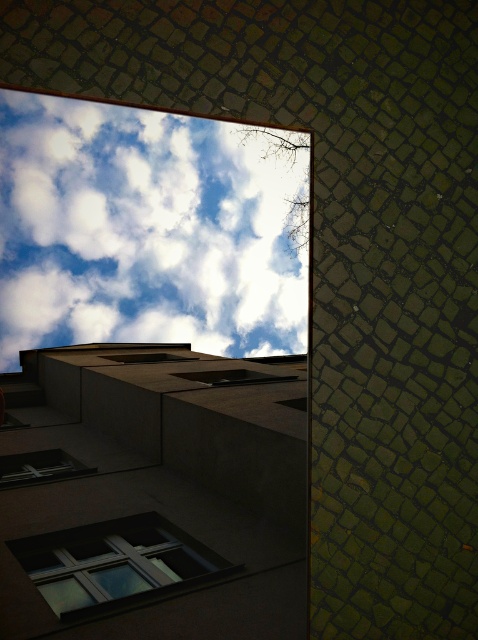
Question: Which point appears closest to the camera in this image?

Choices:
 (A) (181, 321)
 (B) (65, 609)
 (C) (39, 451)

Answer: (C)

Question: Does white fluffy cloud at upper center have a smaller size compared to matte glass window at lower left?

Choices:
 (A) no
 (B) yes

Answer: (A)

Question: Which object is positioned farthest from the matte glass window at lower left?

Choices:
 (A) transparent glass window at lower left
 (B) white fluffy cloud at upper center

Answer: (B)

Question: Can you confirm if white fluffy cloud at upper center is wider than matte glass window at lower left?

Choices:
 (A) yes
 (B) no

Answer: (A)

Question: Can you confirm if white fluffy cloud at upper center is bigger than matte glass window at lower left?

Choices:
 (A) yes
 (B) no

Answer: (A)

Question: Considering the real-world distances, which object is farthest from the matte glass window at lower left?

Choices:
 (A) white fluffy cloud at upper center
 (B) transparent glass window at lower left

Answer: (A)